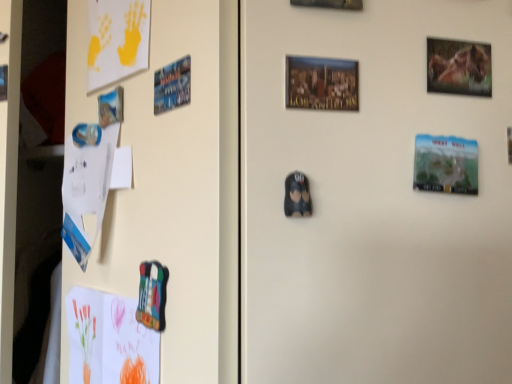
How much space does green matte great wall of china print at right, placed as the second print when sorted from back to front, occupy horizontally?

It is 0.49 inches.

The image size is (512, 384). I want to click on yellow matte paper at upper left, acting as the 1th postcard starting from the top, so tap(117, 40).

What is the approximate width of black matte plush toy at center, the 1th print ordered from the bottom?

The width of black matte plush toy at center, the 1th print ordered from the bottom, is 1.42 centimeters.

You are a GUI agent. You are given a task and a screenshot of the screen. Output one action in this format:
    pyautogui.click(x=<x>, y=<y>)
    Task: Click on the black matte plush toy at center, the 1th print from the front
    The height and width of the screenshot is (384, 512).
    Given the screenshot: What is the action you would take?
    pyautogui.click(x=297, y=196)

The width and height of the screenshot is (512, 384). What do you see at coordinates (172, 85) in the screenshot?
I see `metallic blue magnet at upper left, acting as the 3th print starting from the bottom` at bounding box center [172, 85].

Measure the distance between point [162,77] and camera.

They are 51.50 centimeters apart.

Locate an element on the screen. colored paper postcard at lower left, which ranks as the first postcard in bottom-to-top order is located at coordinates (109, 340).

Where is `metallic glossy horse portrait at upper right`? The width and height of the screenshot is (512, 384). metallic glossy horse portrait at upper right is located at coordinates (458, 67).

What are the coordinates of `green matte great wall of china print at right, which ranks as the second print in bottom-to-top order` in the screenshot? It's located at (446, 164).

Is colored paper postcard at lower left, placed as the 2th postcard when sorted from top to bottom, surrounding black matte plush toy at center, the 1th print ordered from the bottom?

No, colored paper postcard at lower left, placed as the 2th postcard when sorted from top to bottom, does not contain black matte plush toy at center, the 1th print ordered from the bottom.

Is colored paper postcard at lower left, which ranks as the first postcard in bottom-to-top order, far away from black matte plush toy at center, marked as the third print in a top-to-bottom arrangement?

No, colored paper postcard at lower left, which ranks as the first postcard in bottom-to-top order, is not far from black matte plush toy at center, marked as the third print in a top-to-bottom arrangement.

Which object is closer to the camera taking this photo, colored paper postcard at lower left, which ranks as the first postcard in bottom-to-top order, or black matte plush toy at center, the 3th print positioned from the back?

black matte plush toy at center, the 3th print positioned from the back.

At what (x,y) coordinates should I click in order to perform the action: click on print that is the 1st object located above the colored paper postcard at lower left, which ranks as the first postcard in bottom-to-top order (from the image's perspective). Please return your answer as a coordinate pair (x, y). This screenshot has height=384, width=512. Looking at the image, I should click on (297, 196).

Which object is thinner, colored paper postcard at lower left, which ranks as the first postcard in bottom-to-top order, or metallic blue magnet at upper left, the 3th print when ordered from front to back?

With smaller width is metallic blue magnet at upper left, the 3th print when ordered from front to back.

Based on the photo, who is taller, colored paper postcard at lower left, which ranks as the first postcard in bottom-to-top order, or metallic blue magnet at upper left, which ranks as the first print in back-to-front order?

Standing taller between the two is colored paper postcard at lower left, which ranks as the first postcard in bottom-to-top order.

Locate an element on the screen. The height and width of the screenshot is (384, 512). the 3rd print positioned above the colored paper postcard at lower left, which ranks as the first postcard in bottom-to-top order (from the image's perspective) is located at coordinates (172, 85).

Are colored paper postcard at lower left, which ranks as the first postcard in bottom-to-top order, and metallic blue magnet at upper left, which appears as the third print when viewed from the right, far apart?

colored paper postcard at lower left, which ranks as the first postcard in bottom-to-top order, is near metallic blue magnet at upper left, which appears as the third print when viewed from the right, not far away.

Does metallic blue magnet at upper left, placed as the 1th print when sorted from left to right, have a lesser height compared to black matte plush toy at center, marked as the third print in a top-to-bottom arrangement?

In fact, metallic blue magnet at upper left, placed as the 1th print when sorted from left to right, may be taller than black matte plush toy at center, marked as the third print in a top-to-bottom arrangement.

Relative to black matte plush toy at center, the second print when ordered from right to left, is metallic blue magnet at upper left, the 1th print viewed from the top, in front or behind?

Clearly, metallic blue magnet at upper left, the 1th print viewed from the top, is behind black matte plush toy at center, the second print when ordered from right to left.

In terms of size, does metallic blue magnet at upper left, acting as the 3th print starting from the bottom, appear bigger or smaller than black matte plush toy at center, the second print when ordered from right to left?

metallic blue magnet at upper left, acting as the 3th print starting from the bottom, is bigger than black matte plush toy at center, the second print when ordered from right to left.

Would you consider metallic blue magnet at upper left, which appears as the third print when viewed from the right, to be distant from black matte plush toy at center, the 1th print from the front?

That's not correct — metallic blue magnet at upper left, which appears as the third print when viewed from the right, is a little close to black matte plush toy at center, the 1th print from the front.

Considering the points (440, 175) and (477, 81), which point is in front, point (440, 175) or point (477, 81)?

The point (440, 175) is more forward.

From the image's perspective, which object appears higher, green matte great wall of china print at right, which ranks as the second print in bottom-to-top order, or metallic glossy horse portrait at upper right?

metallic glossy horse portrait at upper right.

Is green matte great wall of china print at right, the third print when ordered from left to right, directly adjacent to metallic glossy horse portrait at upper right?

Yes, green matte great wall of china print at right, the third print when ordered from left to right, is touching metallic glossy horse portrait at upper right.

Does green matte great wall of china print at right, placed as the second print when sorted from back to front, have a lesser height compared to metallic glossy horse portrait at upper right?

In fact, green matte great wall of china print at right, placed as the second print when sorted from back to front, may be taller than metallic glossy horse portrait at upper right.

What's the angular difference between green matte great wall of china print at right, the first print viewed from the right, and colored paper postcard at lower left, which ranks as the first postcard in bottom-to-top order,'s facing directions?

They differ by 54 degrees in their facing directions.

Is point (423, 178) farther from camera compared to point (116, 306)?

No, (423, 178) is in front of (116, 306).

From a real-world perspective, between green matte great wall of china print at right, placed as the second print when sorted from back to front, and colored paper postcard at lower left, placed as the 2th postcard when sorted from top to bottom, who is vertically lower?

colored paper postcard at lower left, placed as the 2th postcard when sorted from top to bottom, is physically lower.

Is green matte great wall of china print at right, which ranks as the second print in front-to-back order, oriented away from colored paper postcard at lower left, which ranks as the first postcard in bottom-to-top order?

No, green matte great wall of china print at right, which ranks as the second print in front-to-back order,'s orientation is not away from colored paper postcard at lower left, which ranks as the first postcard in bottom-to-top order.

Is black matte plush toy at center, the 1th print from the front, aimed at green matte great wall of china print at right, which ranks as the second print in front-to-back order?

No, black matte plush toy at center, the 1th print from the front, is not aimed at green matte great wall of china print at right, which ranks as the second print in front-to-back order.

From a real-world perspective, is black matte plush toy at center, marked as the third print in a top-to-bottom arrangement, below green matte great wall of china print at right, which ranks as the second print in front-to-back order?

Indeed, from a real-world perspective, black matte plush toy at center, marked as the third print in a top-to-bottom arrangement, is positioned beneath green matte great wall of china print at right, which ranks as the second print in front-to-back order.

Is black matte plush toy at center, the 1th print ordered from the bottom, not inside green matte great wall of china print at right, arranged as the second print when viewed from the top?

Yes.

Which point is more distant from viewer, (295, 196) or (452, 157)?

The point (452, 157) is farther.

Looking at this image, considering the sizes of objects colored paper postcard at lower left, which ranks as the first postcard in bottom-to-top order, and yellow matte paper at upper left, acting as the 1th postcard starting from the top, in the image provided, who is bigger, colored paper postcard at lower left, which ranks as the first postcard in bottom-to-top order, or yellow matte paper at upper left, acting as the 1th postcard starting from the top,?

With larger size is colored paper postcard at lower left, which ranks as the first postcard in bottom-to-top order.

Based on the photo, considering the sizes of objects colored paper postcard at lower left, which ranks as the first postcard in bottom-to-top order, and yellow matte paper at upper left, acting as the 1th postcard starting from the top, in the image provided, who is wider, colored paper postcard at lower left, which ranks as the first postcard in bottom-to-top order, or yellow matte paper at upper left, acting as the 1th postcard starting from the top,?

With larger width is colored paper postcard at lower left, which ranks as the first postcard in bottom-to-top order.

Could you tell me if colored paper postcard at lower left, which ranks as the first postcard in bottom-to-top order, is turned towards yellow matte paper at upper left, which ranks as the 2th postcard in bottom-to-top order?

No, colored paper postcard at lower left, which ranks as the first postcard in bottom-to-top order, is not turned towards yellow matte paper at upper left, which ranks as the 2th postcard in bottom-to-top order.

This screenshot has width=512, height=384. I want to click on the 1st print above the colored paper postcard at lower left, which ranks as the first postcard in bottom-to-top order (from the image's perspective), so click(297, 196).

You are a GUI agent. You are given a task and a screenshot of the screen. Output one action in this format:
    pyautogui.click(x=<x>, y=<y>)
    Task: Click on the postcard that is below the metallic blue magnet at upper left, the 3th print when ordered from front to back (from the image's perspective)
    
    Given the screenshot: What is the action you would take?
    pyautogui.click(x=109, y=340)

From the image, which object appears to be nearer to metallic glossy horse portrait at upper right, green matte great wall of china print at right, which ranks as the second print in front-to-back order, or metallic blue magnet at upper left, which ranks as the first print in back-to-front order?

green matte great wall of china print at right, which ranks as the second print in front-to-back order, lies closer to metallic glossy horse portrait at upper right than the other object.

Looking at this image, when comparing their distances from colored paper postcard at lower left, placed as the 2th postcard when sorted from top to bottom, does yellow matte paper at upper left, which ranks as the 2th postcard in bottom-to-top order, or metallic blue magnet at upper left, which appears as the third print when viewed from the right, seem further?

yellow matte paper at upper left, which ranks as the 2th postcard in bottom-to-top order, is positioned further to the anchor colored paper postcard at lower left, placed as the 2th postcard when sorted from top to bottom.

Looking at the image, which one is located closer to yellow matte paper at upper left, acting as the 1th postcard starting from the top, colored paper postcard at lower left, placed as the 2th postcard when sorted from top to bottom, or black matte plush toy at center, the 1th print from the front?

colored paper postcard at lower left, placed as the 2th postcard when sorted from top to bottom, lies closer to yellow matte paper at upper left, acting as the 1th postcard starting from the top, than the other object.

Which object lies further to the anchor point colored paper postcard at lower left, placed as the 2th postcard when sorted from top to bottom, metallic blue magnet at upper left, placed as the 1th print when sorted from left to right, or yellow matte paper at upper left, which ranks as the 2th postcard in bottom-to-top order?

yellow matte paper at upper left, which ranks as the 2th postcard in bottom-to-top order, lies further to colored paper postcard at lower left, placed as the 2th postcard when sorted from top to bottom, than the other object.

Consider the image. Considering their positions, is metallic blue magnet at upper left, the 1th print viewed from the top, positioned further to yellow matte paper at upper left, acting as the 1th postcard starting from the top, than colored paper postcard at lower left, placed as the 2th postcard when sorted from top to bottom?

Among the two, colored paper postcard at lower left, placed as the 2th postcard when sorted from top to bottom, is located further to yellow matte paper at upper left, acting as the 1th postcard starting from the top.

Looking at the image, which one is located further to metallic blue magnet at upper left, the 3th print when ordered from front to back, black matte plush toy at center, the 1th print from the front, or yellow matte paper at upper left, which ranks as the 2th postcard in bottom-to-top order?

black matte plush toy at center, the 1th print from the front, is further to metallic blue magnet at upper left, the 3th print when ordered from front to back.

From the image, which object appears to be farther from colored paper postcard at lower left, placed as the 2th postcard when sorted from top to bottom, black matte plush toy at center, marked as the third print in a top-to-bottom arrangement, or green matte great wall of china print at right, placed as the second print when sorted from back to front?

green matte great wall of china print at right, placed as the second print when sorted from back to front, is further to colored paper postcard at lower left, placed as the 2th postcard when sorted from top to bottom.

Based on their spatial positions, is black matte plush toy at center, the 1th print from the front, or yellow matte paper at upper left, acting as the 1th postcard starting from the top, closer to green matte great wall of china print at right, the first print viewed from the right?

The object closer to green matte great wall of china print at right, the first print viewed from the right, is black matte plush toy at center, the 1th print from the front.

Locate an element on the screen. This screenshot has width=512, height=384. print located between metallic blue magnet at upper left, the 1th print viewed from the top, and green matte great wall of china print at right, the first print viewed from the right, in the left-right direction is located at coordinates (297, 196).

The height and width of the screenshot is (384, 512). In order to click on picture frame between yellow matte paper at upper left, acting as the 1th postcard starting from the top, and colored paper postcard at lower left, placed as the 2th postcard when sorted from top to bottom, in the up-down direction in this screenshot , I will do `click(458, 67)`.

You are a GUI agent. You are given a task and a screenshot of the screen. Output one action in this format:
    pyautogui.click(x=<x>, y=<y>)
    Task: Click on the print between black matte plush toy at center, the 3th print positioned from the back, and metallic glossy horse portrait at upper right
    Image resolution: width=512 pixels, height=384 pixels.
    Given the screenshot: What is the action you would take?
    click(446, 164)